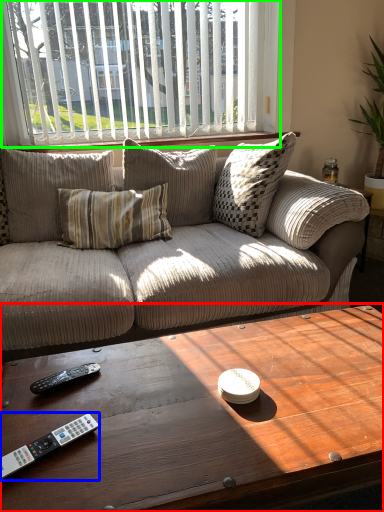
Question: Which is farther away from coffee table (highlighted by a red box)? remote control (highlighted by a blue box) or window (highlighted by a green box)?

Choices:
 (A) remote control
 (B) window

Answer: (B)